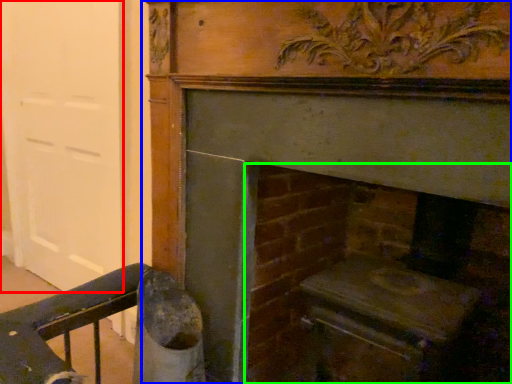
Question: Estimate the real-world distances between objects in this image. Which object is farther from door (highlighted by a red box), fireplace (highlighted by a blue box) or fireplace (highlighted by a green box)?

Choices:
 (A) fireplace
 (B) fireplace

Answer: (B)